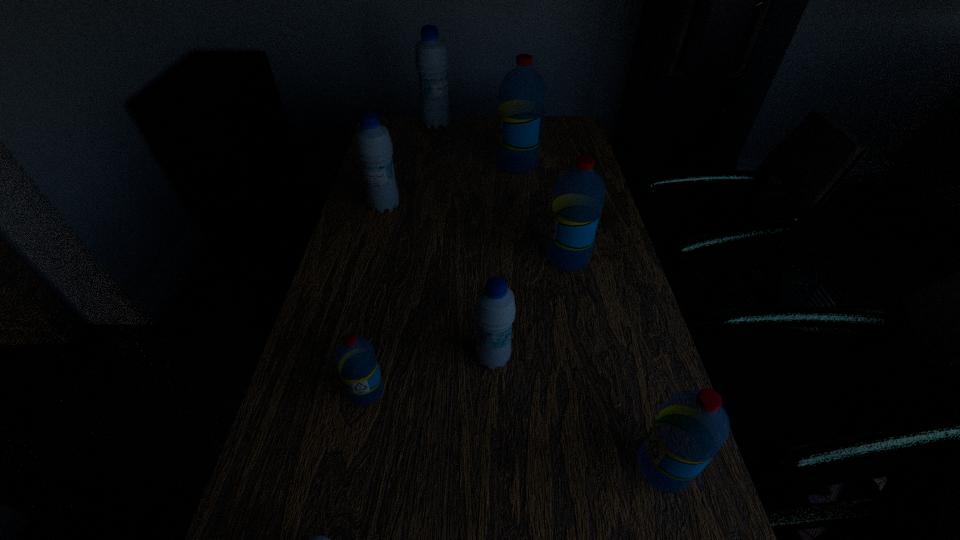
What are the coordinates of `blank space located 0.080m on the front label of the third nearest red water bottle` in the screenshot? It's located at (516, 258).

In order to click on free spot located 0.380m on the front label of the third nearest red water bottle in this screenshot , I will do `click(405, 258)`.

What are the coordinates of `vacant space located on the back of the fifth farthest object` in the screenshot? It's located at (491, 242).

You are a GUI agent. You are given a task and a screenshot of the screen. Output one action in this format:
    pyautogui.click(x=<x>, y=<y>)
    Task: Click on the free space located 0.310m on the front label of the third biggest red water bottle
    
    Given the screenshot: What is the action you would take?
    pyautogui.click(x=467, y=467)

In order to click on free space located on the front label of the third biggest red water bottle in this screenshot , I will do `click(571, 467)`.

Where is `vacant space located 0.150m on the front label of the third biggest red water bottle`? vacant space located 0.150m on the front label of the third biggest red water bottle is located at coordinates (554, 467).

The width and height of the screenshot is (960, 540). I want to click on vacant space situated 0.130m on the front label of the smallest red water bottle, so click(x=350, y=474).

This screenshot has width=960, height=540. Find the location of `object that is at the far edge`. object that is at the far edge is located at coordinates (431, 58).

This screenshot has height=540, width=960. In order to click on object present at the far left corner in this screenshot , I will do `click(431, 58)`.

I want to click on free region at the left edge, so click(x=411, y=164).